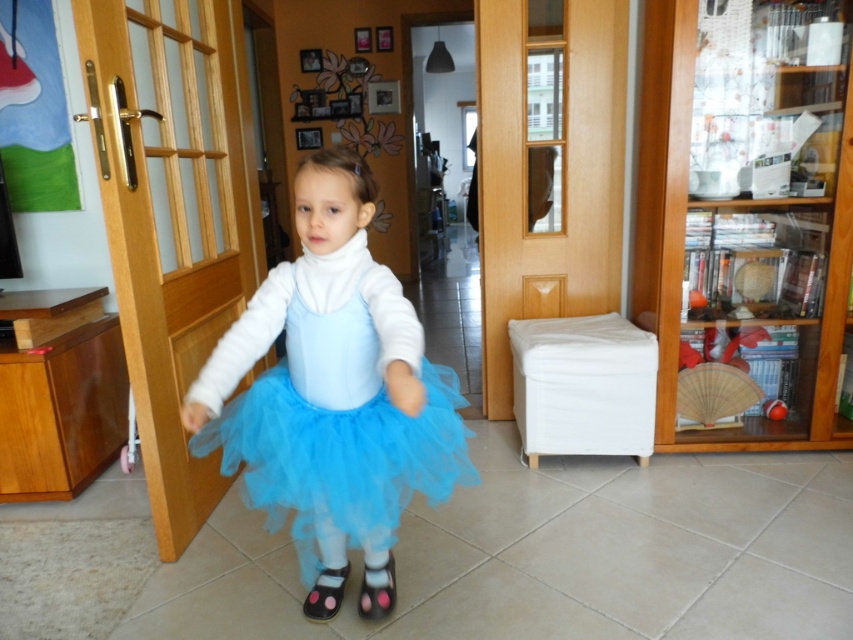
Question: Which point is farther to the camera?

Choices:
 (A) matte blue tulle skirt at center
 (B) pink fabric shoe at lower center

Answer: (A)

Question: Which point appears farthest from the camera in this image?

Choices:
 (A) click(x=375, y=605)
 (B) click(x=357, y=445)
 (C) click(x=346, y=451)

Answer: (A)

Question: Does tulle skirt at center lie in front of pink fabric shoe at lower center?

Choices:
 (A) yes
 (B) no

Answer: (A)

Question: Based on their relative distances, which object is farther from the tulle skirt at center?

Choices:
 (A) light blue tulle tutu at center
 (B) pink fabric shoe at lower center

Answer: (B)

Question: Does light blue tulle tutu at center appear on the left side of pink fabric shoe at lower center?

Choices:
 (A) no
 (B) yes

Answer: (B)

Question: Is light blue tulle tutu at center to the left of tulle skirt at center from the viewer's perspective?

Choices:
 (A) no
 (B) yes

Answer: (B)